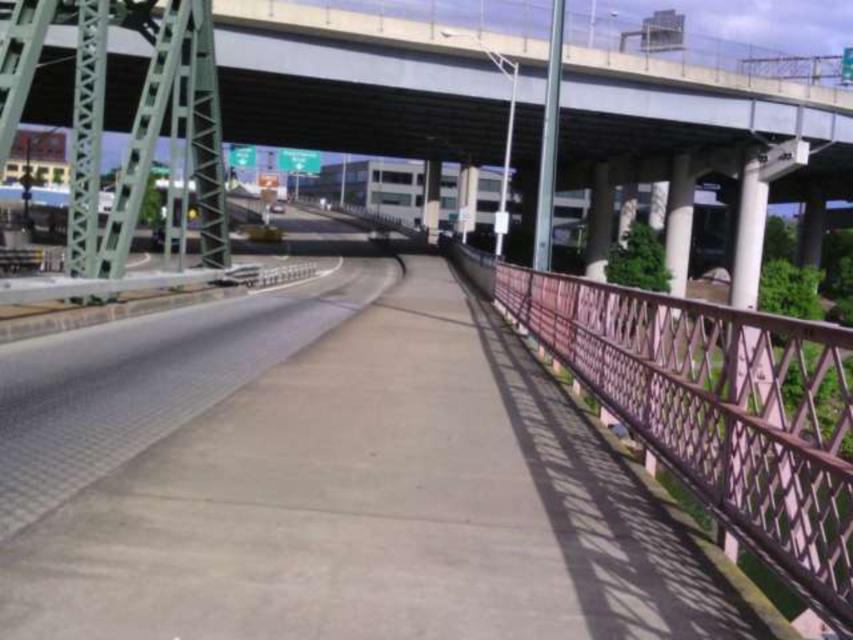
You are a delivery person pushing a cart that is 1.2 meters wide. You need to navigate through the space between the concrete sidewalk at center and the pink metal railing at right. Can your cart fit through the gap between them?

The concrete sidewalk at center is positioned on the left side of the pink metal railing at right. Since the sidewalk is on the left and the railing is on the right, the gap between them would be the width of the sidewalk itself. However, the description does not provide specific measurements of the sidewalk or the gap. Without knowing the exact width of the sidewalk or the distance between the sidewalk and the railing, it is impossible to determine if the 1.2 meter wide cart can fit through the gap. More

You are a delivery person carrying a heavy box and need to walk from the start of the concrete sidewalk at center to the end. The concrete bridge at upper center is directly above your path. Is there enough vertical clearance for you to pass underneath it without hitting your head?

The concrete sidewalk at center is in front of the concrete bridge at upper center, meaning the bridge is above the sidewalk. Since the sidewalk is under the bridge, there should be sufficient vertical clearance for you to walk underneath the concrete bridge at upper center without hitting your head.